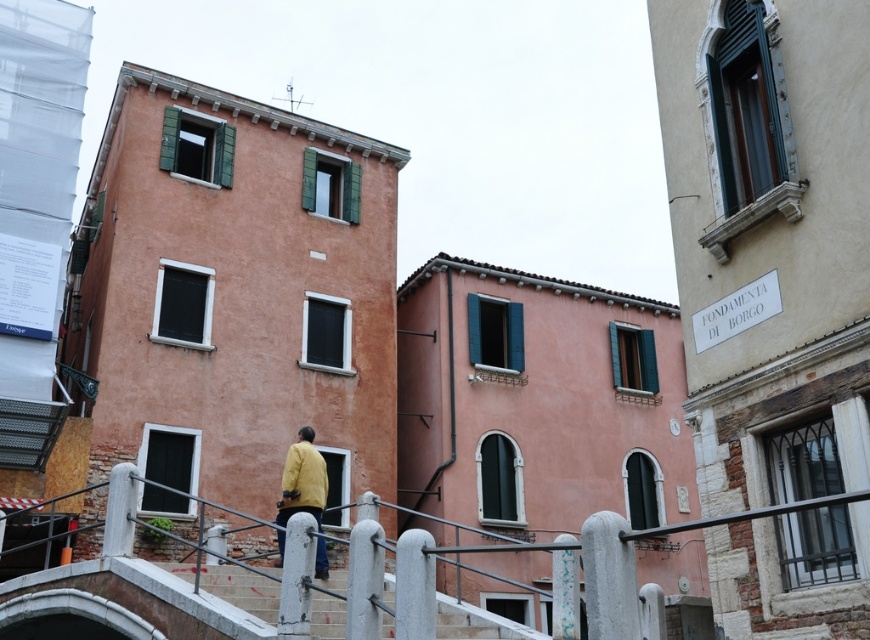
Who is positioned more to the left, white metal railing at lower center or yellow matte jacket at center?

yellow matte jacket at center

Is point (88, 589) less distant than point (308, 481)?

Yes, it is in front of point (308, 481).

Does point (362, 602) come closer to viewer compared to point (282, 552)?

Yes, point (362, 602) is in front of point (282, 552).

What are the coordinates of `white metal railing at lower center` in the screenshot? It's located at (162, 596).

Does point (296, 529) come behind point (438, 604)?

That is False.

Does white metal railing at lower center have a greater height compared to concrete stairs at lower center?

Yes.

Identify the location of white metal railing at lower center. This screenshot has width=870, height=640. (162, 596).

Between concrete stairs at lower center and yellow matte jacket at center, which one appears on the right side from the viewer's perspective?

From the viewer's perspective, concrete stairs at lower center appears more on the right side.

Does concrete stairs at lower center lie in front of yellow matte jacket at center?

Yes, it is in front of yellow matte jacket at center.

This screenshot has width=870, height=640. I want to click on concrete stairs at lower center, so click(x=242, y=589).